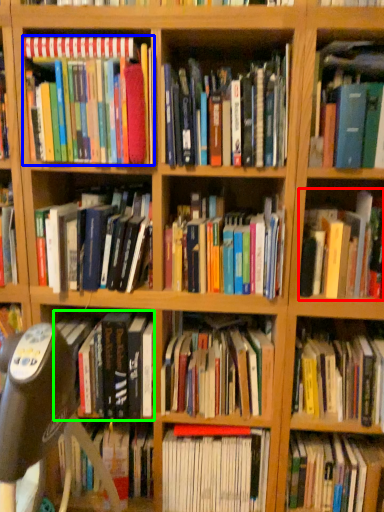
Question: Which object is positioned closest to book (highlighted by a red box)? Select from book (highlighted by a blue box) and book (highlighted by a green box).

Choices:
 (A) book
 (B) book

Answer: (B)